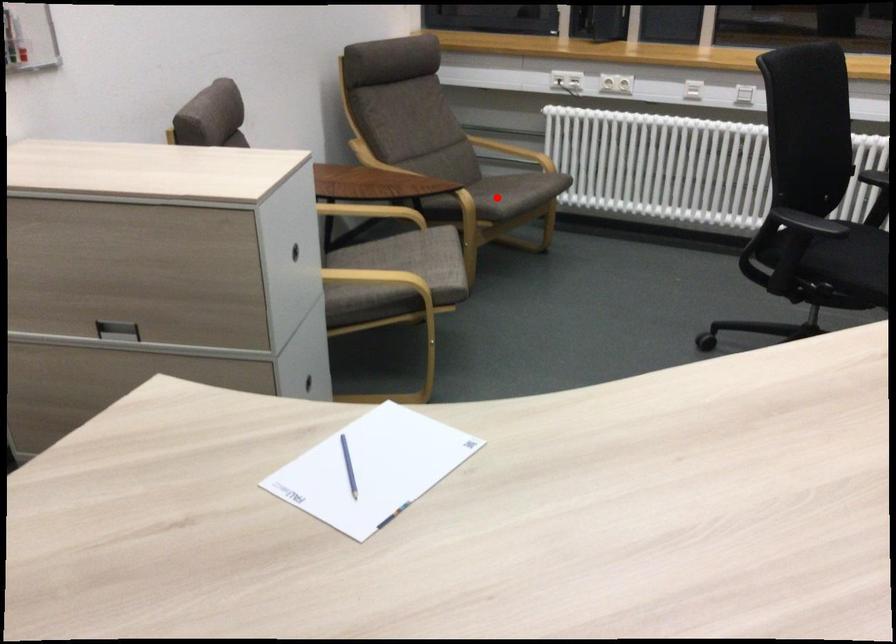
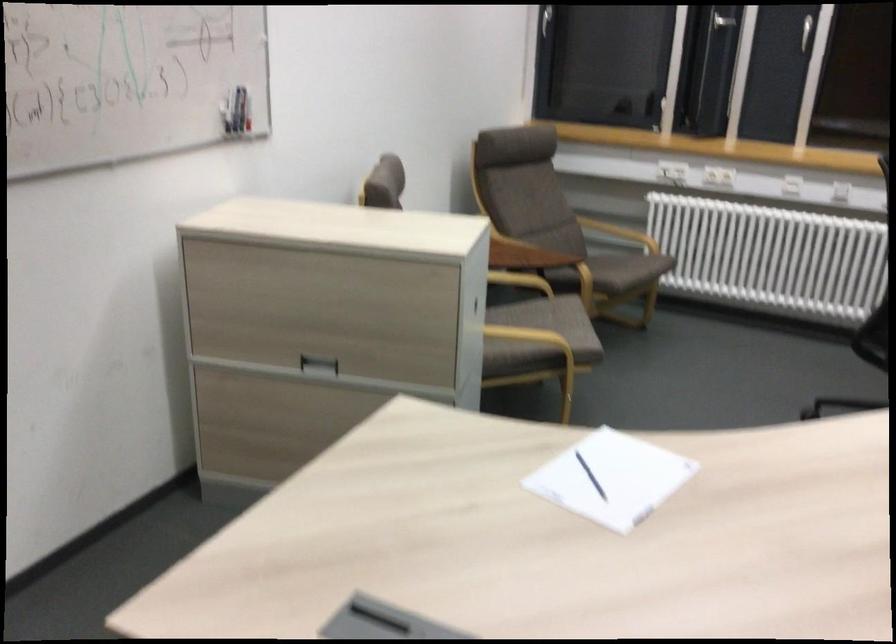
In the second image, find the point that corresponds to the highlighted location in the first image.

(618, 270)